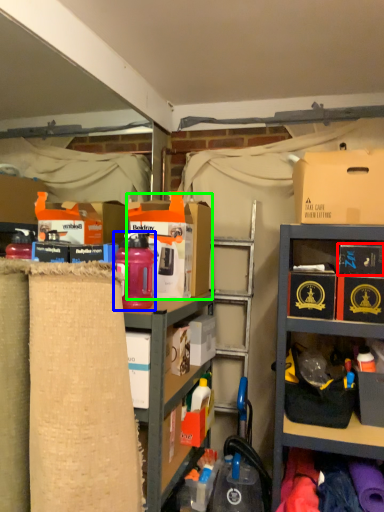
Question: Which object is the farthest from storage box (highlighted by a red box)? Choose among these: bottle (highlighted by a blue box) or storage box (highlighted by a green box).

Choices:
 (A) bottle
 (B) storage box

Answer: (A)